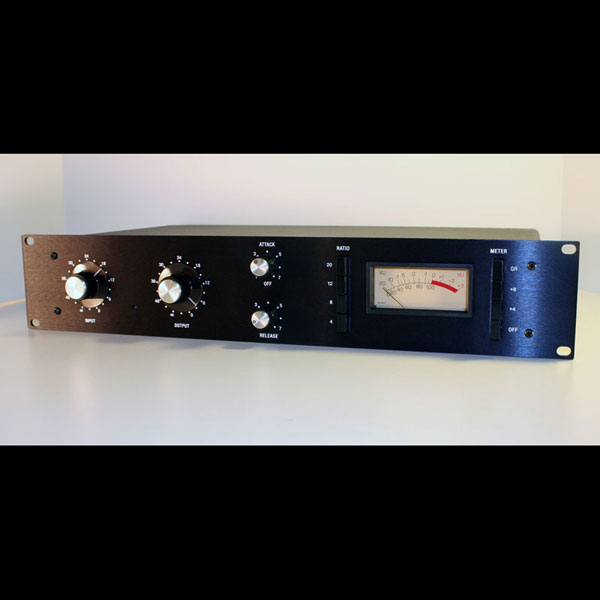
The width and height of the screenshot is (600, 600). I want to click on small knobs, so click(x=254, y=281), click(x=254, y=326).